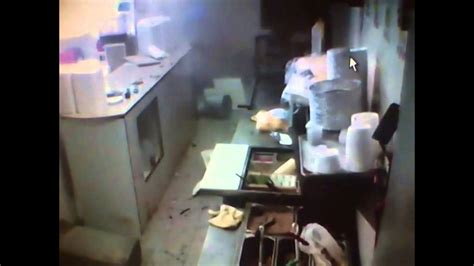
This screenshot has height=266, width=474. I want to click on floor, so click(x=187, y=165).